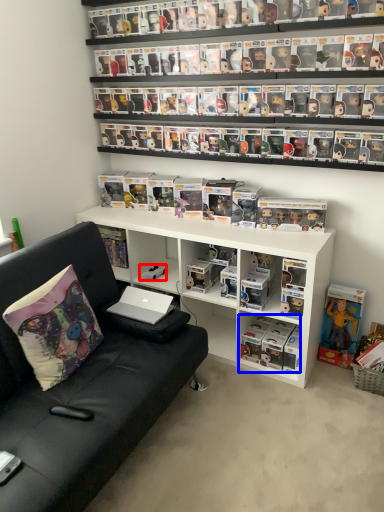
Question: Which object is further to the camera taking this photo, toy (highlighted by a red box) or book (highlighted by a blue box)?

Choices:
 (A) toy
 (B) book

Answer: (A)